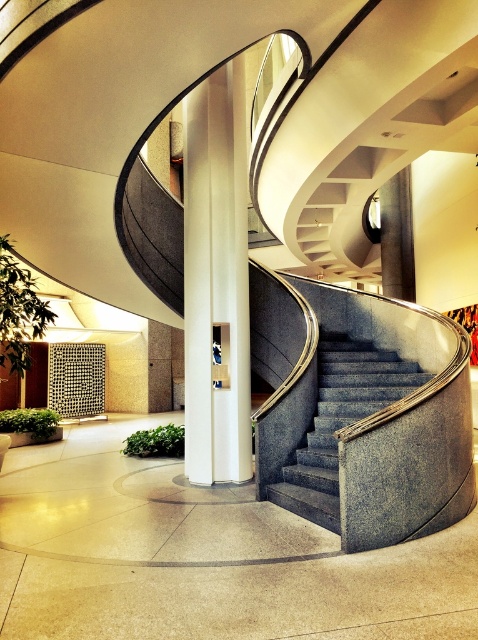
Can you confirm if gray granite stairs at center is positioned to the right of white glossy pillar at upper center?

No, gray granite stairs at center is not to the right of white glossy pillar at upper center.

Is gray granite stairs at center below white glossy pillar at upper center?

Indeed, gray granite stairs at center is positioned under white glossy pillar at upper center.

Between point (325, 340) and point (382, 268), which one is positioned behind?

Positioned behind is point (382, 268).

Locate an element on the screen. gray granite stairs at center is located at coordinates (339, 420).

Between granite gray stairs at center and gray granite stairs at center, which one is positioned lower?

Positioned lower is gray granite stairs at center.

Does granite gray stairs at center appear on the left side of gray granite stairs at center?

Incorrect, granite gray stairs at center is not on the left side of gray granite stairs at center.

Based on the photo, measure the distance between point (352, 538) and camera.

Point (352, 538) and camera are 13.42 feet apart from each other.

Image resolution: width=478 pixels, height=640 pixels. Find the location of `granite gray stairs at center`. granite gray stairs at center is located at coordinates (373, 412).

Based on the photo, who is shorter, white glossy pillar at center or white glossy pillar at upper center?

Standing shorter between the two is white glossy pillar at upper center.

Is white glossy pillar at center thinner than white glossy pillar at upper center?

In fact, white glossy pillar at center might be wider than white glossy pillar at upper center.

Who is more forward, (x=228, y=244) or (x=393, y=228)?

Point (x=228, y=244) is in front.

Where is `white glossy pillar at center`? This screenshot has width=478, height=640. white glossy pillar at center is located at coordinates (217, 278).